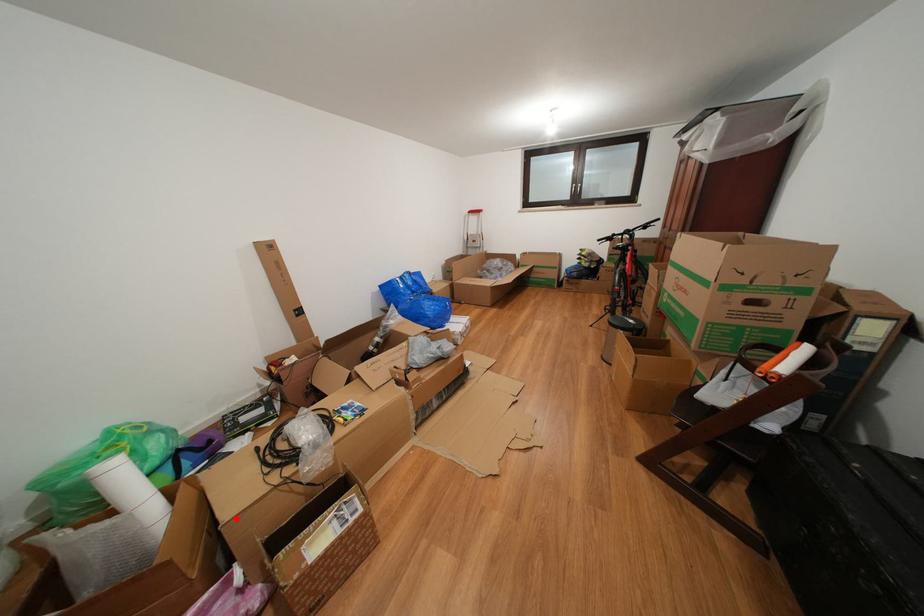
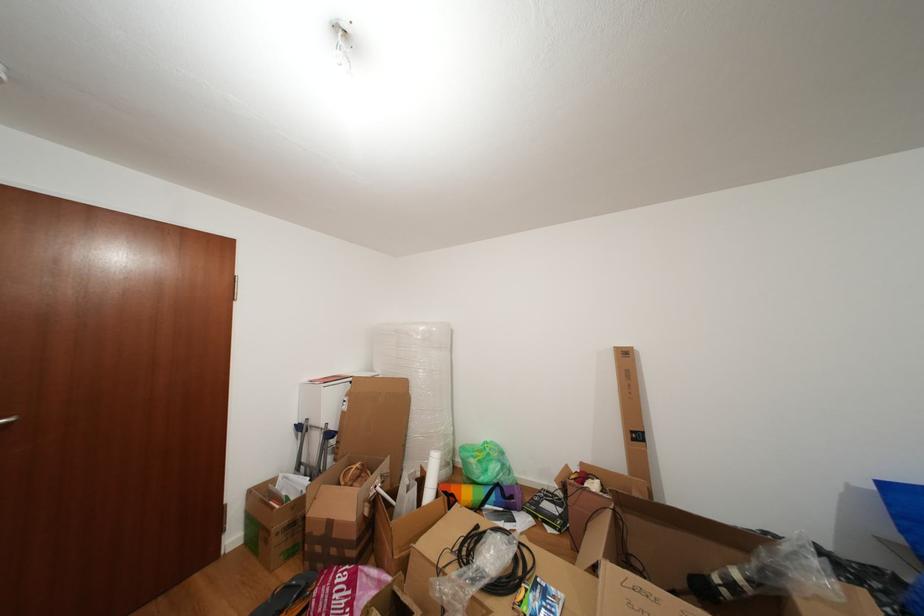
In the second image, find the point that corresponds to the highlighted location in the first image.

(431, 548)